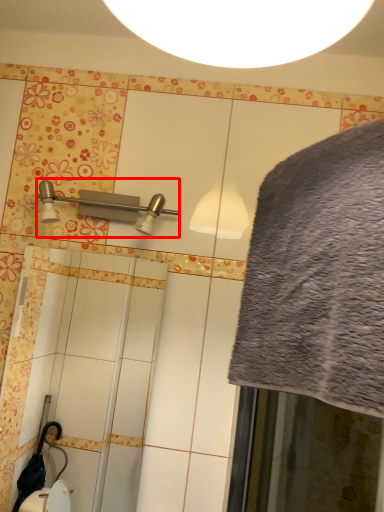
Question: From the image's perspective, where is shower (annotated by the red box) located relative to bath towel?

Choices:
 (A) above
 (B) below

Answer: (A)